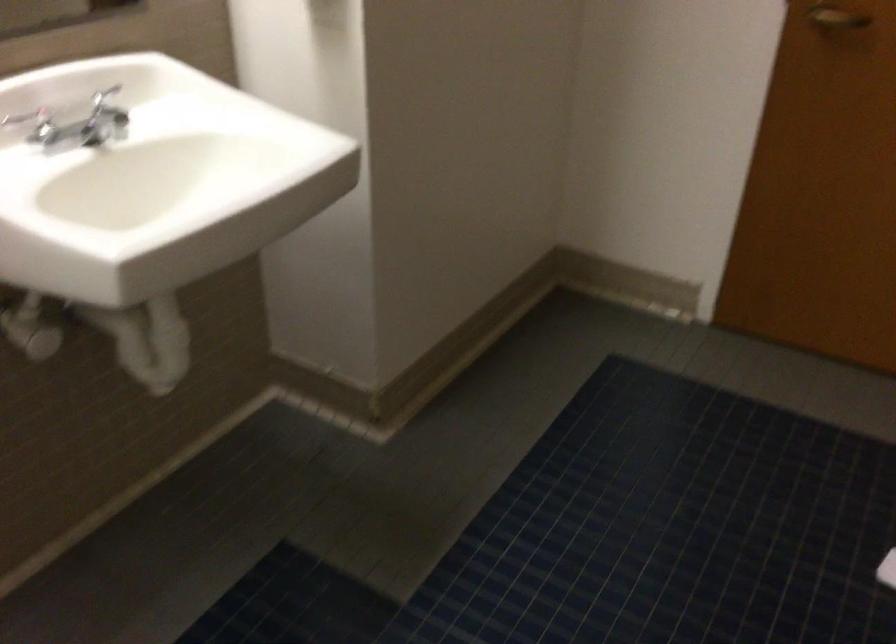
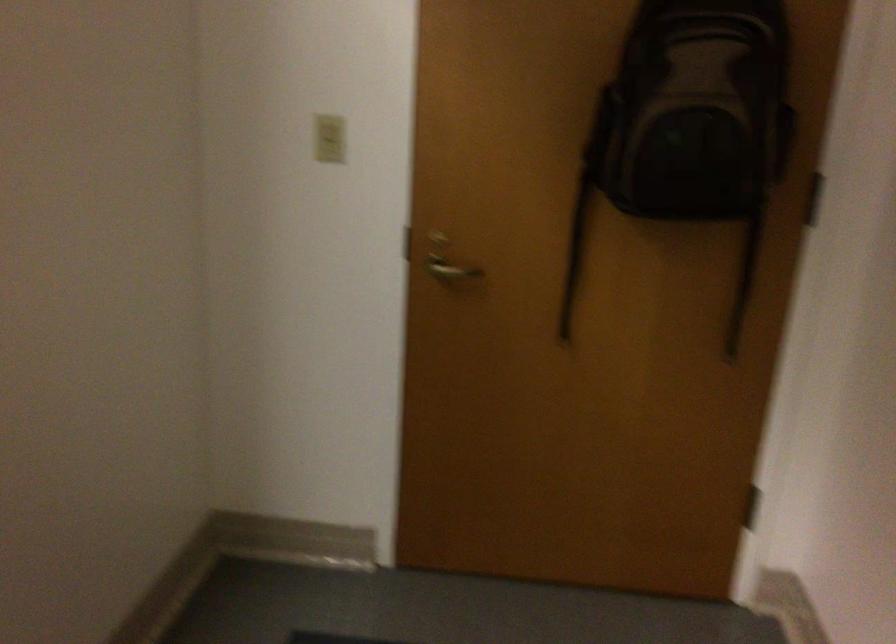
Question: The camera is either moving clockwise (left) or counter-clockwise (right) around the object. The first image is from the beginning of the video and the second image is from the end. Is the camera moving left or right when shooting the video?

Choices:
 (A) Left
 (B) Right

Answer: (A)